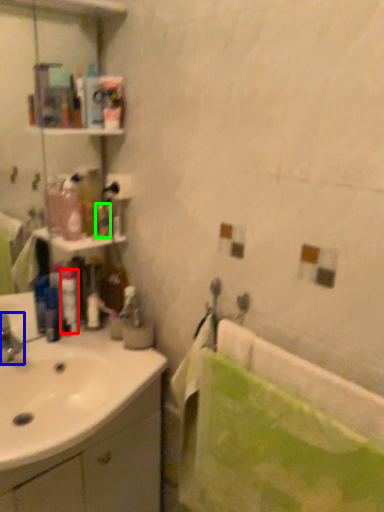
Question: Estimate the real-world distances between objects in this image. Which object is farther from toiletry (highlighted by a red box), tap (highlighted by a blue box) or toiletry (highlighted by a green box)?

Choices:
 (A) tap
 (B) toiletry

Answer: (B)